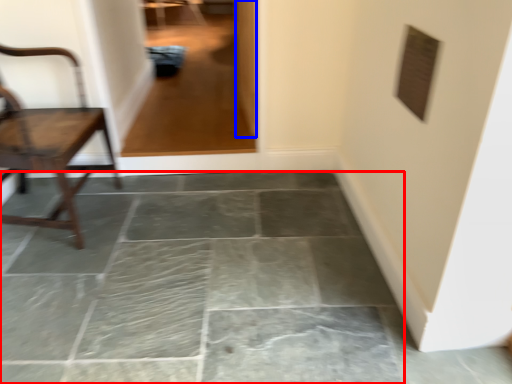
Question: Which point is further to the camera, concrete (highlighted by a red box) or glass door (highlighted by a blue box)?

Choices:
 (A) concrete
 (B) glass door

Answer: (B)